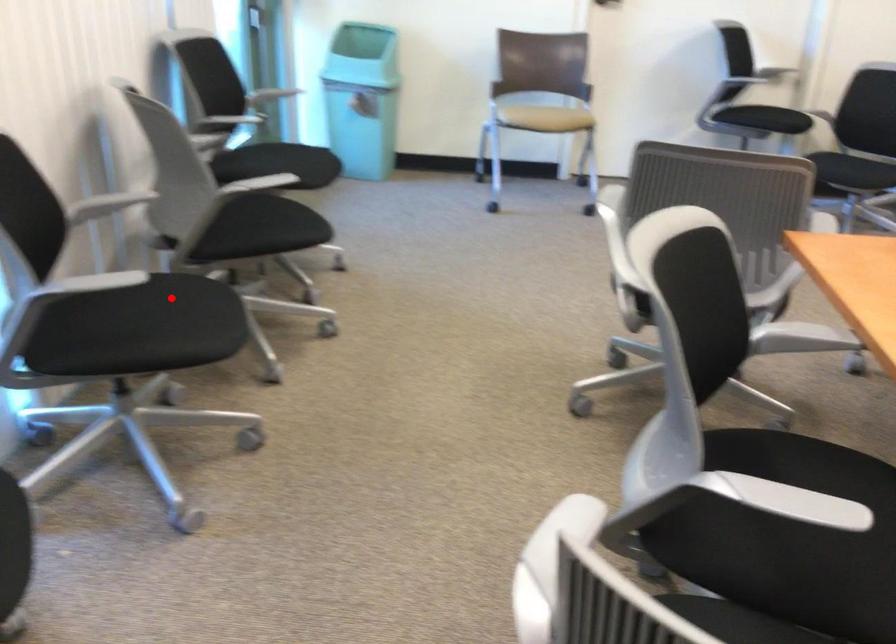
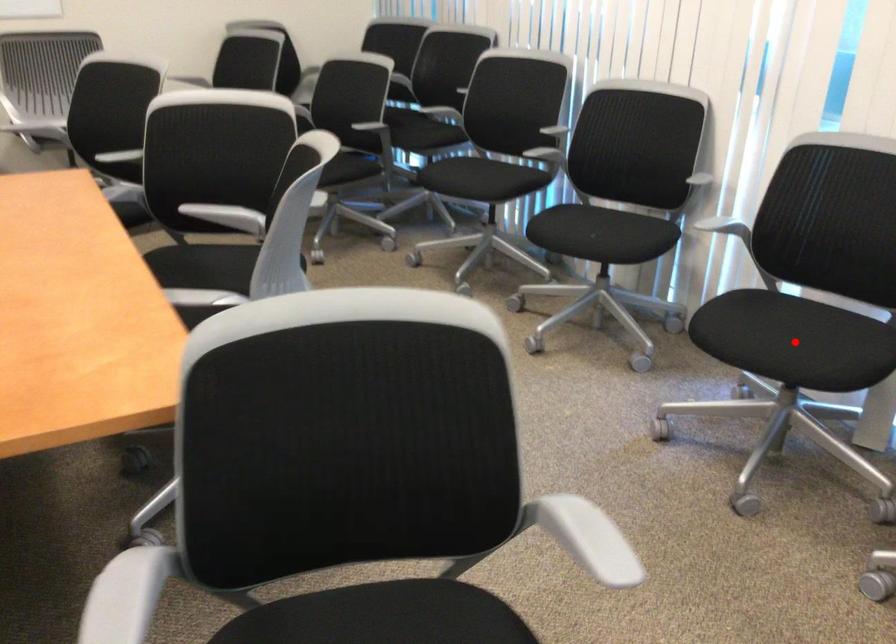
I am providing you with two images of the same scene from different viewpoints. A red point is marked on the first image and another point is marked on the second image. Are the points marked in image1 and image2 representing the same 3D position?

Yes